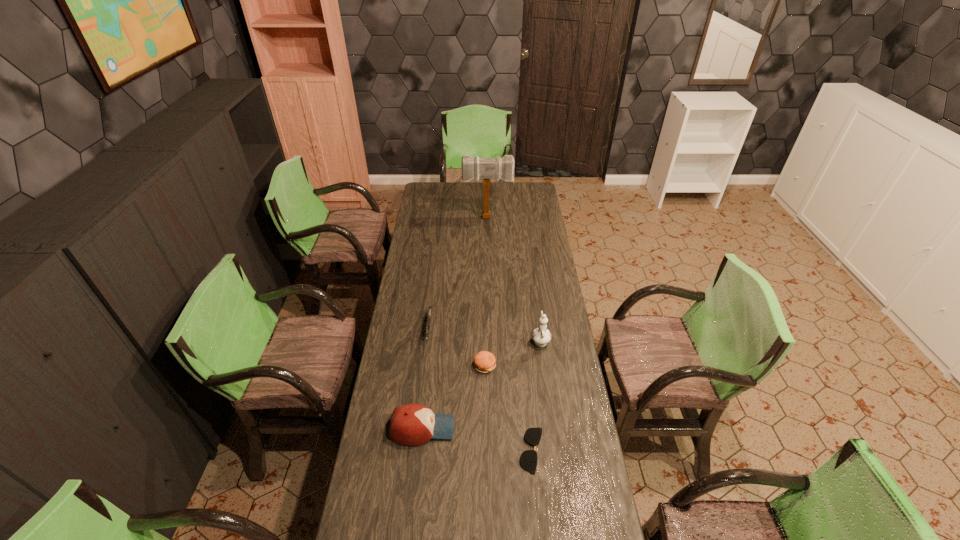
In the image, there is a desktop. Where is `vacant area at the far edge`? vacant area at the far edge is located at coordinates (512, 186).

You are a GUI agent. You are given a task and a screenshot of the screen. Output one action in this format:
    pyautogui.click(x=<x>, y=<y>)
    Task: Click on the vacant space at the left edge of the desktop
    The height and width of the screenshot is (540, 960).
    Given the screenshot: What is the action you would take?
    pyautogui.click(x=373, y=458)

Identify the location of vacant space at the right edge of the desktop. (534, 314).

Identify the location of free space between the fifth tallest object and the baseball cap. (453, 397).

What are the coordinates of `unoccupied area between the chinaware and the fourth tallest object` in the screenshot? It's located at (485, 335).

Find the location of a particular element. vacant space that is in between the tallest object and the third nearest object is located at coordinates (486, 291).

In order to click on vacant point located between the baseball cap and the farthest object in this screenshot , I will do [x=455, y=323].

At what (x,y) coordinates should I click in order to perform the action: click on empty space between the baseball cap and the gun. Please return your answer as a coordinate pair (x, y). The height and width of the screenshot is (540, 960). Looking at the image, I should click on (425, 380).

Where is `vacant point located between the spectacles and the fifth shortest object`? This screenshot has width=960, height=540. vacant point located between the spectacles and the fifth shortest object is located at coordinates (537, 395).

You are a GUI agent. You are given a task and a screenshot of the screen. Output one action in this format:
    pyautogui.click(x=<x>, y=<y>)
    Task: Click on the free spot between the farthest object and the fifth shortest object
    This screenshot has width=960, height=540.
    Given the screenshot: What is the action you would take?
    pyautogui.click(x=514, y=279)